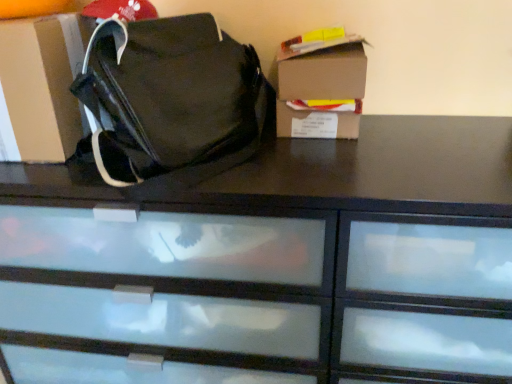
Locate an element on the screen. The image size is (512, 384). matte black bag at center is located at coordinates (168, 95).

Describe the element at coordinates (322, 90) in the screenshot. The height and width of the screenshot is (384, 512). I see `cardboard box at upper right` at that location.

The image size is (512, 384). Find the location of `cardboard box at upper right`. cardboard box at upper right is located at coordinates (322, 90).

The height and width of the screenshot is (384, 512). What are the coordinates of `black glossy chest of drawers at center` in the screenshot? It's located at point(377,170).

At what (x,y) coordinates should I click in order to perform the action: click on matte black bag at center. Please return your answer as a coordinate pair (x, y). This screenshot has height=384, width=512. Looking at the image, I should click on [168, 95].

Is black glossy chest of drawers at center facing towards cardboard box at upper right?

No, black glossy chest of drawers at center does not turn towards cardboard box at upper right.

Which point is more forward, (253, 199) or (284, 121)?

The point (253, 199) is closer to the camera.

Consider the image. How many degrees apart are the facing directions of black glossy chest of drawers at center and cardboard box at upper right?

3.67 degrees.

Considering the sizes of objects black glossy chest of drawers at center and cardboard box at upper right in the image provided, who is bigger, black glossy chest of drawers at center or cardboard box at upper right?

black glossy chest of drawers at center.

From a real-world perspective, which is physically above, cardboard box at upper right or cardboard box at left?

cardboard box at left is physically above.

Looking at this image, is cardboard box at left surrounded by cardboard box at upper right?

No, cardboard box at left is located outside of cardboard box at upper right.

Who is smaller, matte black bag at center or black glossy chest of drawers at center?

Smaller between the two is matte black bag at center.

Which is more to the right, matte black bag at center or black glossy chest of drawers at center?

From the viewer's perspective, black glossy chest of drawers at center appears more on the right side.

Considering their positions, is matte black bag at center located in front of or behind black glossy chest of drawers at center?

matte black bag at center is in front of black glossy chest of drawers at center.

Considering the positions of points (0, 127) and (297, 90), is point (0, 127) farther from camera compared to point (297, 90)?

No, it is not.

Would you say cardboard box at left is inside or outside cardboard box at upper right?

cardboard box at left lies outside cardboard box at upper right.

You are a GUI agent. You are given a task and a screenshot of the screen. Output one action in this format:
    pyautogui.click(x=<x>, y=<y>)
    Task: Click on the storage box on the right of the cardboard box at left
    
    Given the screenshot: What is the action you would take?
    pyautogui.click(x=322, y=90)

Is black glossy chest of drawers at center not within matte black bag at center?

Absolutely, black glossy chest of drawers at center is external to matte black bag at center.

What's the angular difference between black glossy chest of drawers at center and matte black bag at center's facing directions?

64.9 degrees separate the facing orientations of black glossy chest of drawers at center and matte black bag at center.

From the image's perspective, is black glossy chest of drawers at center located above or below matte black bag at center?

black glossy chest of drawers at center is situated lower than matte black bag at center in the image.

Considering the relative sizes of black glossy chest of drawers at center and matte black bag at center in the image provided, is black glossy chest of drawers at center wider than matte black bag at center?

Yes, black glossy chest of drawers at center is wider than matte black bag at center.

At what (x,y) coordinates should I click in order to perform the action: click on cardboard box behind the black glossy chest of drawers at center. Please return your answer as a coordinate pair (x, y). Image resolution: width=512 pixels, height=384 pixels. Looking at the image, I should click on (41, 87).

From the image's perspective, is cardboard box at left above or below black glossy chest of drawers at center?

From the image's perspective, cardboard box at left appears above black glossy chest of drawers at center.

Is cardboard box at left taller or shorter than black glossy chest of drawers at center?

Clearly, cardboard box at left is shorter compared to black glossy chest of drawers at center.

Is cardboard box at left not within black glossy chest of drawers at center?

cardboard box at left is positioned outside black glossy chest of drawers at center.

Considering the relative sizes of matte black bag at center and cardboard box at upper right in the image provided, is matte black bag at center wider than cardboard box at upper right?

Yes, matte black bag at center is wider than cardboard box at upper right.

What's the angular difference between matte black bag at center and cardboard box at upper right's facing directions?

The facing directions of matte black bag at center and cardboard box at upper right are 68.5 degrees apart.

Is matte black bag at center to the left or to the right of cardboard box at upper right in the image?

Clearly, matte black bag at center is on the left of cardboard box at upper right in the image.

Measure the distance between matte black bag at center and cardboard box at upper right.

matte black bag at center is 8.49 inches away from cardboard box at upper right.

The image size is (512, 384). Find the location of `the chest of drawers directly beneath the cardboard box at upper right (from a real-world perspective)`. the chest of drawers directly beneath the cardboard box at upper right (from a real-world perspective) is located at coordinates (377, 170).

You are a GUI agent. You are given a task and a screenshot of the screen. Output one action in this format:
    pyautogui.click(x=<x>, y=<y>)
    Task: Click on the storage box below the cardboard box at left (from the image's perspective)
    Image resolution: width=512 pixels, height=384 pixels.
    Given the screenshot: What is the action you would take?
    pyautogui.click(x=322, y=90)

Considering their positions, is black glossy chest of drawers at center positioned further to matte black bag at center than cardboard box at upper right?

Among the two, cardboard box at upper right is located further to matte black bag at center.

Considering their positions, is black glossy chest of drawers at center positioned further to cardboard box at upper right than cardboard box at left?

The object further to cardboard box at upper right is cardboard box at left.

From the image, which object appears to be nearer to black glossy chest of drawers at center, cardboard box at left or cardboard box at upper right?

Among the two, cardboard box at upper right is located nearer to black glossy chest of drawers at center.

When comparing their distances from cardboard box at left, does cardboard box at upper right or matte black bag at center seem further?

cardboard box at upper right is further to cardboard box at left.

From the image, which object appears to be farther from cardboard box at upper right, cardboard box at left or matte black bag at center?

The object further to cardboard box at upper right is cardboard box at left.

When comparing their distances from cardboard box at left, does matte black bag at center or black glossy chest of drawers at center seem closer?

The object closer to cardboard box at left is matte black bag at center.

Based on their spatial positions, is cardboard box at left or cardboard box at upper right further from matte black bag at center?

cardboard box at upper right.

From the image, which object appears to be nearer to cardboard box at left, cardboard box at upper right or black glossy chest of drawers at center?

black glossy chest of drawers at center.

Locate an element on the screen. handbag located between cardboard box at left and black glossy chest of drawers at center in the left-right direction is located at coordinates (168, 95).

Where is `chest of drawers between cardboard box at left and cardboard box at upper right`? The width and height of the screenshot is (512, 384). chest of drawers between cardboard box at left and cardboard box at upper right is located at coordinates (377, 170).

Locate an element on the screen. storage box between matte black bag at center and black glossy chest of drawers at center in the up-down direction is located at coordinates (322, 90).

Identify the location of handbag between cardboard box at left and cardboard box at upper right from left to right. (168, 95).